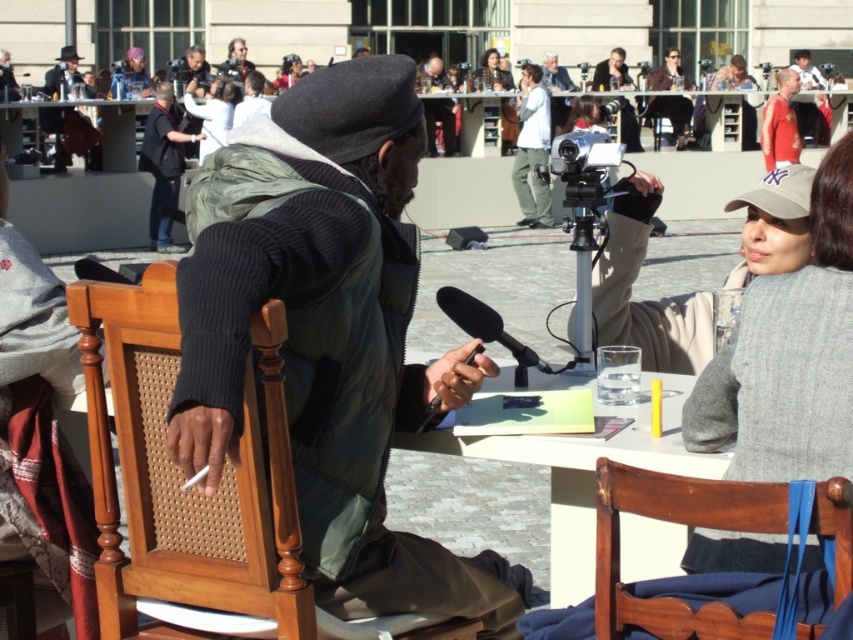
Question: Does silver metallic video camera at center appear on the left side of wooden table at center?

Choices:
 (A) yes
 (B) no

Answer: (B)

Question: Which of the following is the farthest from the observer?

Choices:
 (A) black matte microphone at center
 (B) gray woolen sweater at upper right
 (C) wooden table at center

Answer: (C)

Question: Which point is farther to the camera?

Choices:
 (A) (677, 84)
 (B) (759, 280)
 (C) (564, 120)

Answer: (A)

Question: Does green fabric vest at center have a smaller size compared to smooth leather jacket at upper right?

Choices:
 (A) yes
 (B) no

Answer: (A)

Question: Which point appears closest to the camera in this image?

Choices:
 (A) (670, 64)
 (B) (593, 97)
 (C) (408, 289)

Answer: (C)

Question: Does silver metallic video camera at center appear on the left side of smooth leather jacket at upper right?

Choices:
 (A) no
 (B) yes

Answer: (B)